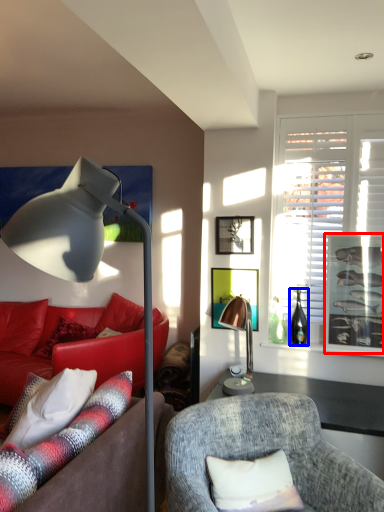
Question: Which point is further to the camera, picture frame (highlighted by a red box) or bottle (highlighted by a blue box)?

Choices:
 (A) picture frame
 (B) bottle

Answer: (B)